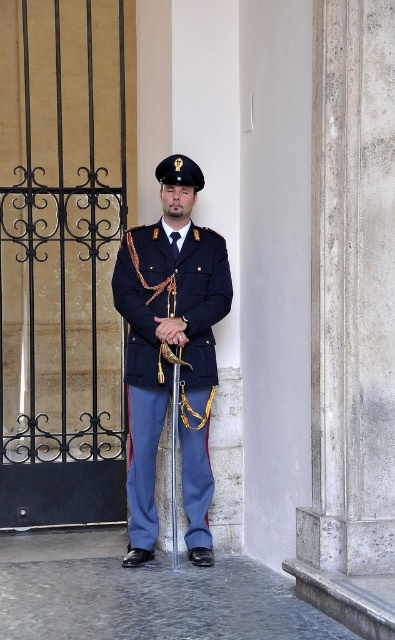
Who is positioned more to the left, navy blue fabric uniform at center or metallic gold pole at center?

navy blue fabric uniform at center is more to the left.

Between navy blue fabric uniform at center and metallic gold pole at center, which one has more height?

navy blue fabric uniform at center

Is point (150, 440) more distant than point (176, 364)?

Yes, it is behind point (176, 364).

The width and height of the screenshot is (395, 640). I want to click on navy blue fabric uniform at center, so click(159, 342).

Is black wrought iron gate at left above metallic gold pole at center?

Indeed, black wrought iron gate at left is positioned over metallic gold pole at center.

Is black wrought iron gate at left thinner than metallic gold pole at center?

Incorrect, black wrought iron gate at left's width is not less than metallic gold pole at center's.

Find the location of `black wrought iron gate at left`. black wrought iron gate at left is located at coordinates (62, 257).

Between black wrought iron gate at left and navy blue fabric uniform at center, which one is positioned higher?

black wrought iron gate at left

The height and width of the screenshot is (640, 395). In order to click on black wrought iron gate at left in this screenshot , I will do `click(62, 257)`.

Where is `black wrought iron gate at left`? The width and height of the screenshot is (395, 640). black wrought iron gate at left is located at coordinates (62, 257).